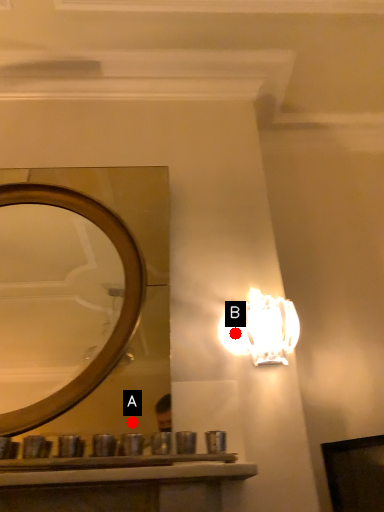
Question: Two points are circled on the image, labeled by A and B beside each circle. Which point appears closest to the camera in this image?

Choices:
 (A) A is closer
 (B) B is closer

Answer: (A)